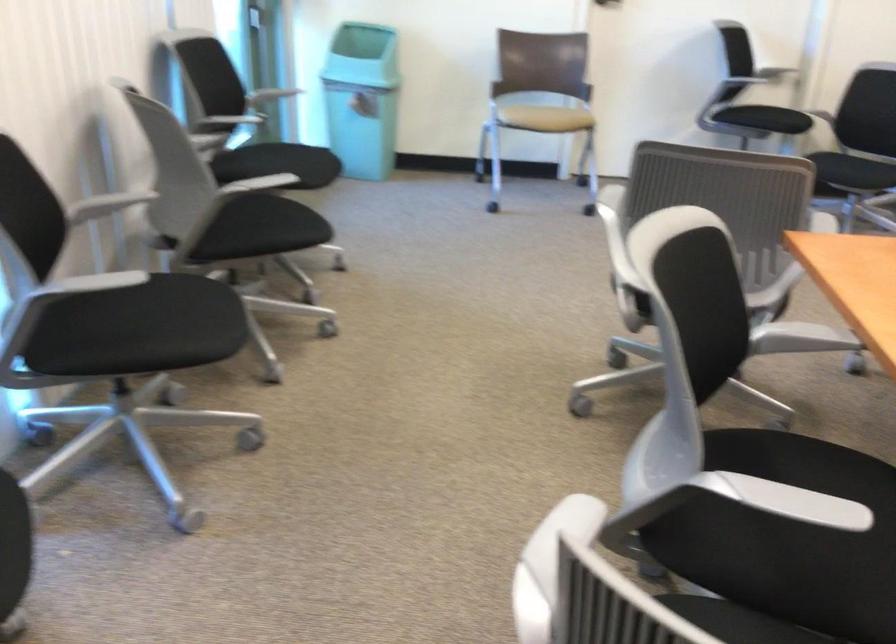
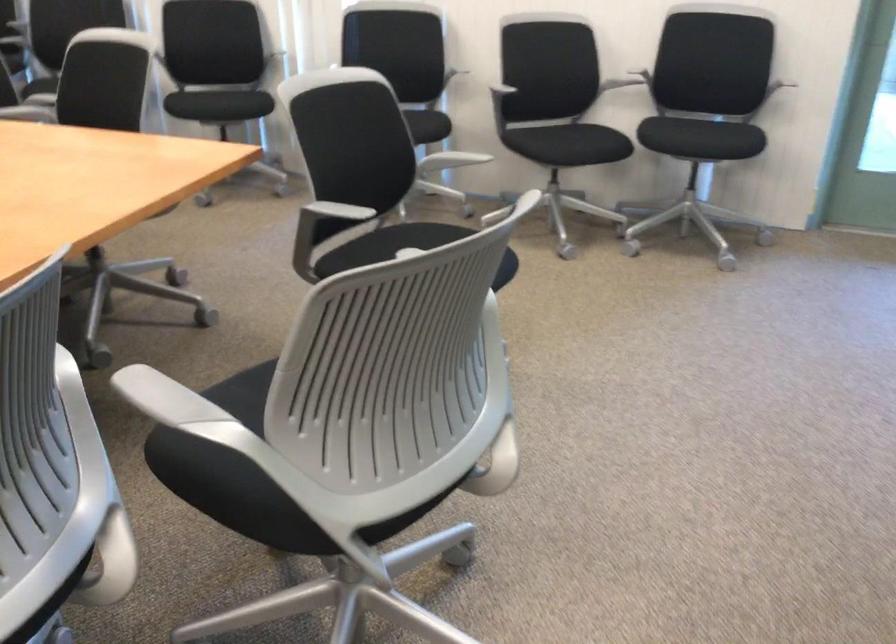
In the second image, find the point that corresponds to (x=244, y=118) in the first image.

(778, 86)